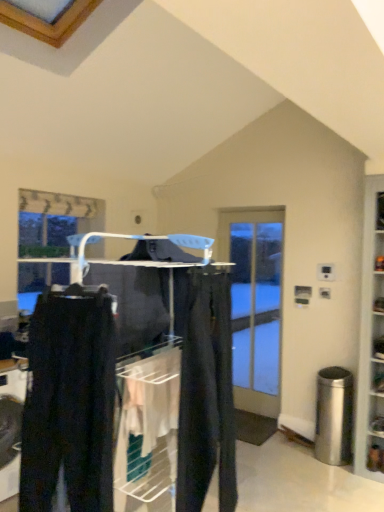
Question: Considering the positions of dark gray pants at center and matte black pants at center in the image, is dark gray pants at center wider or thinner than matte black pants at center?

Choices:
 (A) wide
 (B) thin

Answer: (A)

Question: In the image, is dark gray pants at center positioned in front of or behind matte black pants at center?

Choices:
 (A) front
 (B) behind

Answer: (A)

Question: Which is nearer to the matte black pants at center?

Choices:
 (A) clear glass door at center
 (B) dark gray pants at center
 (C) matte black pants at center

Answer: (B)

Question: Which object is positioned farthest from the clear glass door at center?

Choices:
 (A) dark gray pants at center
 (B) matte black pants at center
 (C) matte black pants at center

Answer: (A)